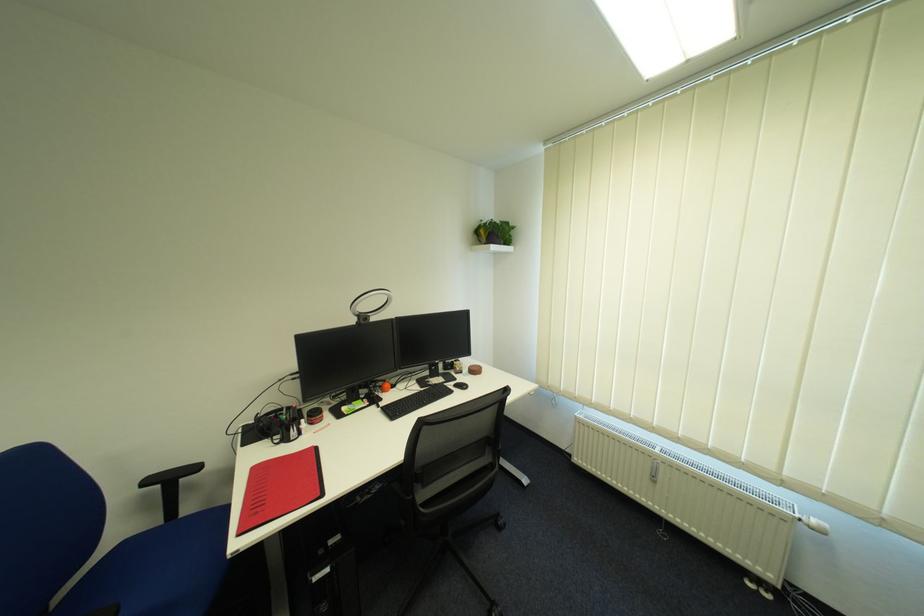
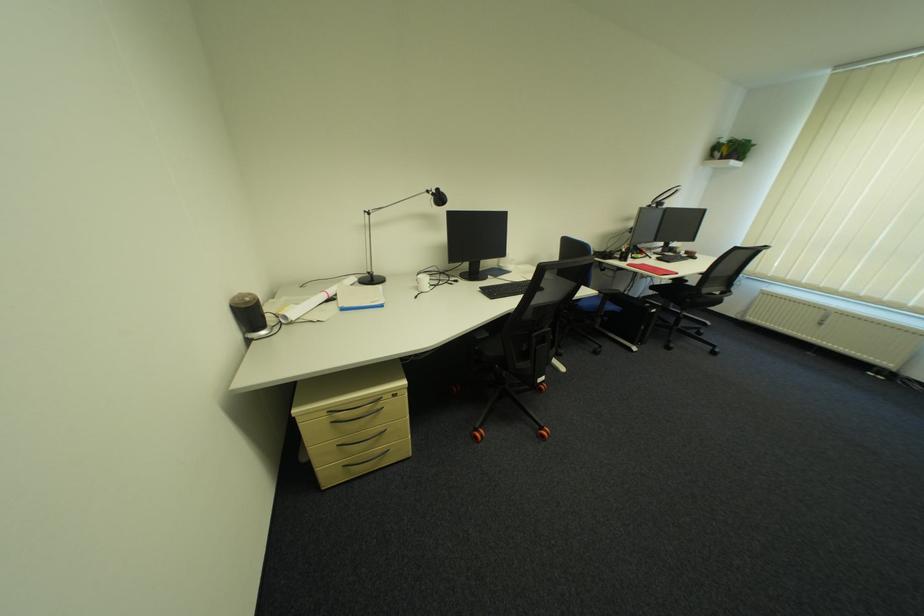
Locate, in the second image, the point that corresponds to point (468, 370) in the first image.

(687, 252)